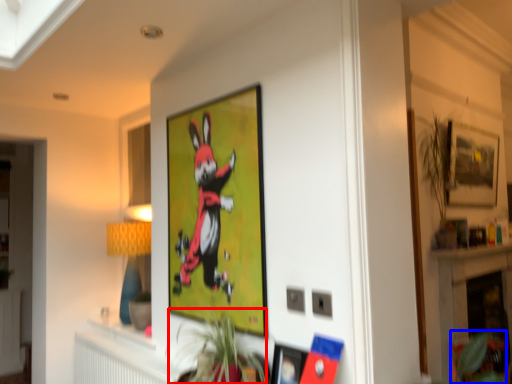
Question: Which of the following is the farthest to the observer, plant (highlighted by a red box) or plant (highlighted by a blue box)?

Choices:
 (A) plant
 (B) plant

Answer: (B)